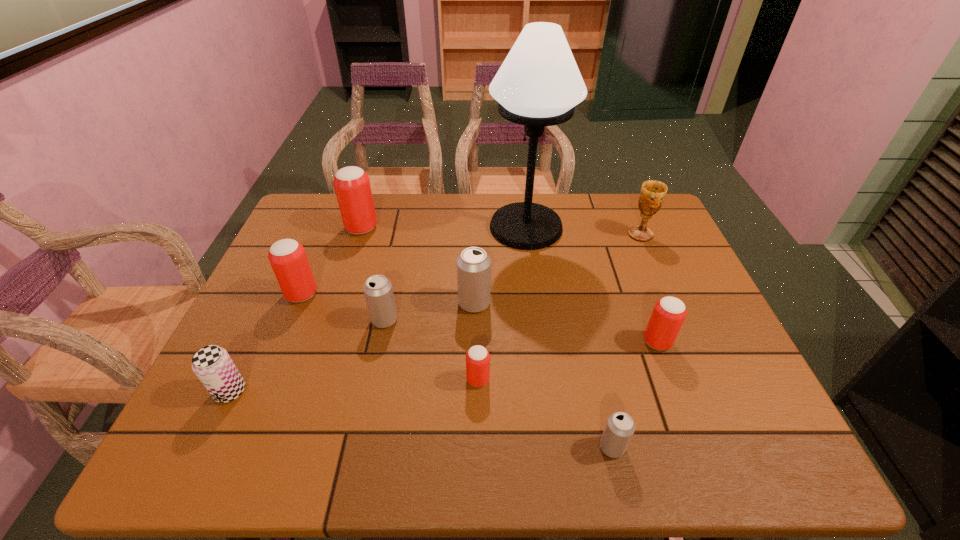
Select which beer can appears as the fourth closest to the nearest beer can. Please provide its 2D coordinates. Your answer should be formatted as a tuple, i.e. [(x, y)], where the tuple contains the x and y coordinates of a point satisfying the conditions above.

[(378, 291)]

Locate an element on the screen. beer can identified as the sixth closest to the purple beer can is located at coordinates (620, 427).

Locate which red beer can is the second closest to the black table lamp. Please provide its 2D coordinates. Your answer should be formatted as a tuple, i.e. [(x, y)], where the tuple contains the x and y coordinates of a point satisfying the conditions above.

[(352, 186)]

Where is `red beer can that is the third closest to the second white beer can from right to left`? red beer can that is the third closest to the second white beer can from right to left is located at coordinates (669, 313).

What are the coordinates of `the closest white beer can relative to the purple beer can` in the screenshot? It's located at (378, 291).

Identify which white beer can is the third closest to the smallest red beer can. Please provide its 2D coordinates. Your answer should be formatted as a tuple, i.e. [(x, y)], where the tuple contains the x and y coordinates of a point satisfying the conditions above.

[(620, 427)]

This screenshot has width=960, height=540. What are the coordinates of `vacant point that satisfies the following two spatial constraints: 1. on the back side of the black table lamp; 2. on the left side of the farthest beer can` in the screenshot? It's located at (362, 227).

Where is `free space that satisfies the following two spatial constraints: 1. on the back side of the rightmost object; 2. on the left side of the second farthest red beer can`? Image resolution: width=960 pixels, height=540 pixels. free space that satisfies the following two spatial constraints: 1. on the back side of the rightmost object; 2. on the left side of the second farthest red beer can is located at coordinates (326, 235).